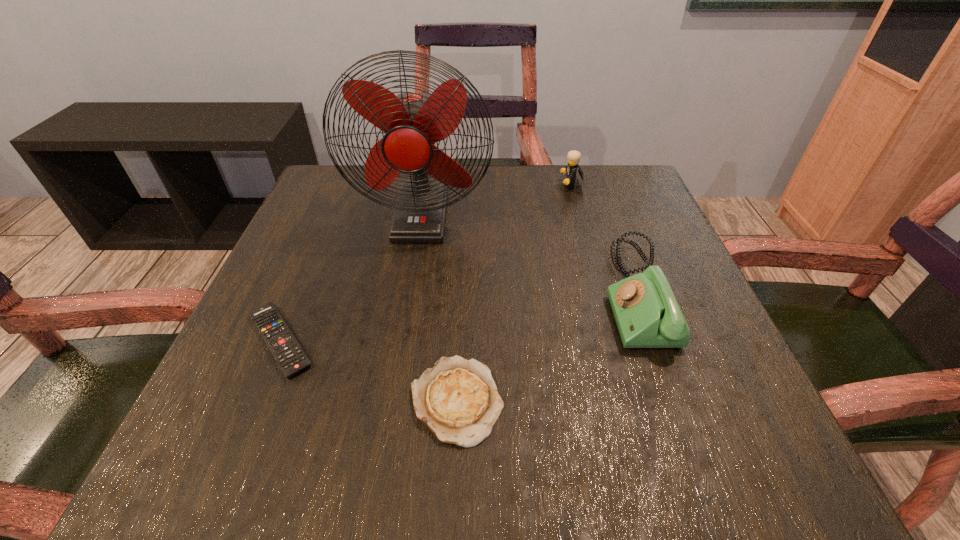
At what (x,y) coordinates should I click in order to perform the action: click on free space located on the dial of the telephone. Please return your answer as a coordinate pair (x, y). Looking at the image, I should click on (435, 294).

Locate an element on the screen. The height and width of the screenshot is (540, 960). free location located on the dial of the telephone is located at coordinates 495,294.

Where is `vacant space located 0.190m on the left of the second shortest object`? The width and height of the screenshot is (960, 540). vacant space located 0.190m on the left of the second shortest object is located at coordinates (280, 400).

At what (x,y) coordinates should I click in order to perform the action: click on free space located 0.220m on the back of the shortest object. Please return your answer as a coordinate pair (x, y). This screenshot has width=960, height=540. Looking at the image, I should click on (326, 231).

Where is `fan that is at the far edge`? fan that is at the far edge is located at coordinates (413, 122).

Locate an element on the screen. The image size is (960, 540). Lego located in the far edge section of the desktop is located at coordinates (574, 156).

I want to click on object present at the near edge, so click(458, 400).

At what (x,y) coordinates should I click in order to perform the action: click on fan that is at the left edge. Please return your answer as a coordinate pair (x, y). Looking at the image, I should click on (413, 122).

The image size is (960, 540). In order to click on remote control that is at the left edge in this screenshot , I will do `click(291, 358)`.

Where is `Lego that is at the right edge`? The width and height of the screenshot is (960, 540). Lego that is at the right edge is located at coordinates (574, 156).